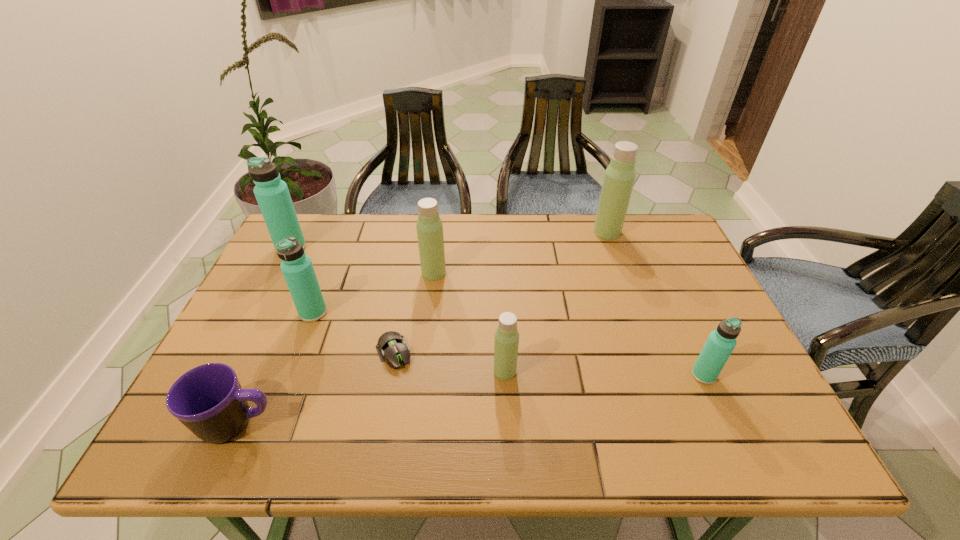
Find the location of a particular element. This screenshot has height=540, width=960. the rightmost aqua thermos bottle is located at coordinates (721, 342).

Locate an element on the screen. This screenshot has width=960, height=540. the smallest aqua thermos bottle is located at coordinates (721, 342).

The height and width of the screenshot is (540, 960). I want to click on black mug, so click(x=208, y=399).

This screenshot has width=960, height=540. I want to click on the nearest object, so click(x=208, y=399).

At what (x,y) coordinates should I click in order to perform the action: click on computer mouse. Please return your answer as a coordinate pair (x, y). Looking at the image, I should click on (392, 346).

What are the coordinates of `gray computer mouse` in the screenshot? It's located at (392, 346).

The image size is (960, 540). I want to click on blank space located on the front of the biggest light thermos bottle, so click(624, 278).

The width and height of the screenshot is (960, 540). I want to click on vacant area situated on the back of the leftmost aqua thermos bottle, so click(x=305, y=219).

The width and height of the screenshot is (960, 540). In order to click on blank space located 0.380m on the right of the second farthest light thermos bottle in this screenshot , I will do `click(576, 273)`.

You are a GUI agent. You are given a task and a screenshot of the screen. Output one action in this format:
    pyautogui.click(x=<x>, y=<y>)
    Task: Click on the free space located on the back of the second thermos bottle from left to right
    The width and height of the screenshot is (960, 540).
    Given the screenshot: What is the action you would take?
    pyautogui.click(x=348, y=220)